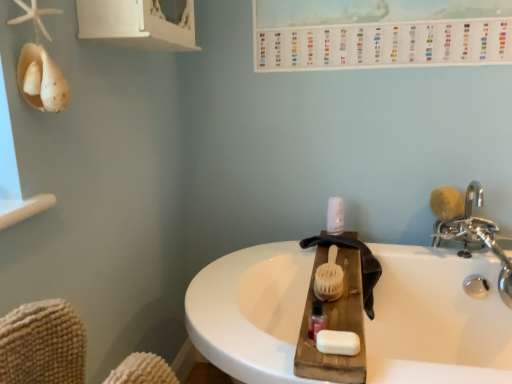
Question: Considering the relative sizes of yellow sponge at right, acting as the second brush starting from the bottom, and white plastic pump at center in the image provided, is yellow sponge at right, acting as the second brush starting from the bottom, smaller than white plastic pump at center?

Choices:
 (A) yes
 (B) no

Answer: (B)

Question: Could you tell me if yellow sponge at right, placed as the 1th brush when sorted from right to left, is facing white plastic pump at center?

Choices:
 (A) no
 (B) yes

Answer: (A)

Question: Can you confirm if yellow sponge at right, placed as the 1th brush when sorted from right to left, is positioned to the left of white plastic pump at center?

Choices:
 (A) no
 (B) yes

Answer: (A)

Question: Are yellow sponge at right, which appears as the second brush when viewed from the front, and white plastic pump at center beside each other?

Choices:
 (A) yes
 (B) no

Answer: (B)

Question: Can you confirm if yellow sponge at right, which is the 1th brush from top to bottom, is positioned to the right of white plastic pump at center?

Choices:
 (A) no
 (B) yes

Answer: (B)

Question: Is yellow sponge at right, which is the 1th brush from top to bottom, far from white plastic pump at center?

Choices:
 (A) no
 (B) yes

Answer: (A)

Question: From the image's perspective, is white matte soap at center beneath white bristle brush at center, positioned as the 2th brush in right-to-left order?

Choices:
 (A) no
 (B) yes

Answer: (B)

Question: Is white matte soap at center behind white bristle brush at center, positioned as the 2th brush in right-to-left order?

Choices:
 (A) yes
 (B) no

Answer: (B)

Question: Considering the relative positions of white matte soap at center and white bristle brush at center, the 1th brush when ordered from bottom to top, in the image provided, is white matte soap at center in front of white bristle brush at center, the 1th brush when ordered from bottom to top,?

Choices:
 (A) yes
 (B) no

Answer: (A)

Question: Is white matte soap at center wider than white bristle brush at center, the 2th brush when ordered from back to front?

Choices:
 (A) no
 (B) yes

Answer: (A)

Question: Is white matte soap at center beside white bristle brush at center, placed as the 1th brush when sorted from front to back?

Choices:
 (A) no
 (B) yes

Answer: (A)

Question: Is white matte soap at center not within white bristle brush at center, positioned as the 2th brush in right-to-left order?

Choices:
 (A) yes
 (B) no

Answer: (A)

Question: Is silver metallic faucet at upper right thinner than white plastic pump at center?

Choices:
 (A) no
 (B) yes

Answer: (A)